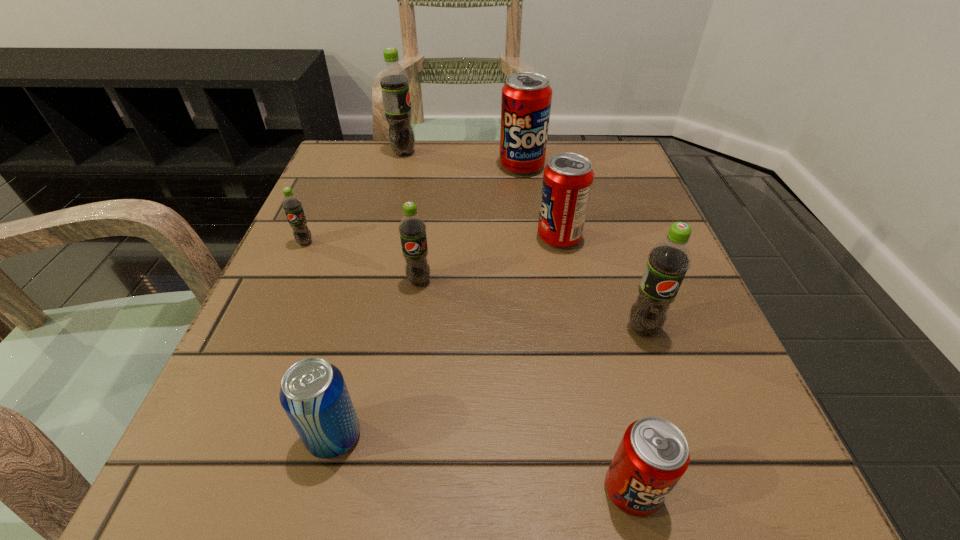
Locate an element on the screen. The image size is (960, 540). the second soda can from left to right is located at coordinates (394, 82).

Locate an element on the screen. the biggest green soda is located at coordinates (394, 82).

This screenshot has width=960, height=540. Find the location of `the farthest red soda can`. the farthest red soda can is located at coordinates (526, 99).

The width and height of the screenshot is (960, 540). I want to click on the sixth farthest soda can, so click(x=668, y=261).

Identify the location of the third smallest green soda. tap(668, 261).

You are a GUI agent. You are given a task and a screenshot of the screen. Output one action in this format:
    pyautogui.click(x=<x>, y=<y>)
    Task: Click on the third biggest green soda
    Image resolution: width=960 pixels, height=540 pixels.
    Given the screenshot: What is the action you would take?
    pyautogui.click(x=412, y=228)

The width and height of the screenshot is (960, 540). Identify the location of the second nearest green soda. (412, 228).

Image resolution: width=960 pixels, height=540 pixels. What are the coordinates of `the second biggest red soda can` in the screenshot? It's located at (568, 177).

This screenshot has width=960, height=540. Find the location of `blue beer can`. blue beer can is located at coordinates (313, 393).

Identify the location of the second nearest object. (313, 393).